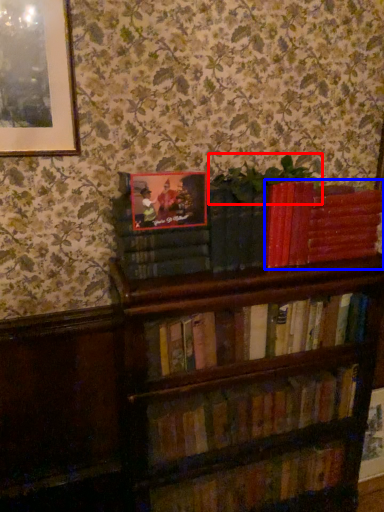
Question: Among these objects, which one is farthest to the camera, plant (highlighted by a red box) or book (highlighted by a blue box)?

Choices:
 (A) plant
 (B) book

Answer: (B)